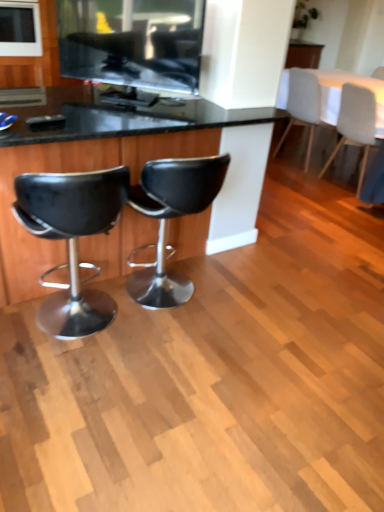
Locate an element on the screen. Image resolution: width=384 pixels, height=512 pixels. vacant area located to the right-hand side of black leather stool at left, which is the 4th chair from back to front is located at coordinates (174, 359).